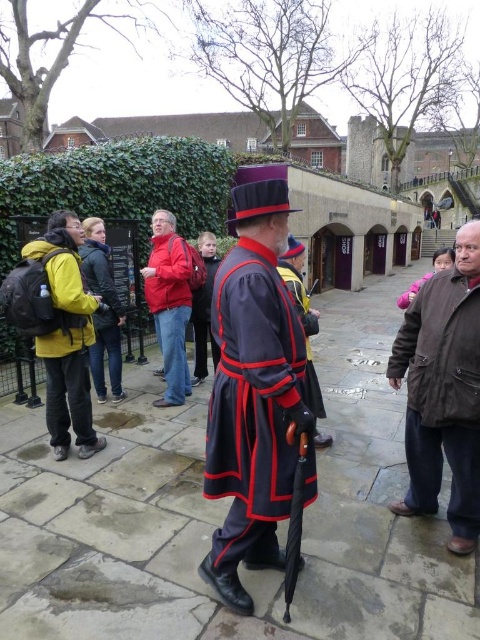
You are a photographer standing at the camera position. You want to take a photo focusing on the point at coordinates point (478, 262) and point (312, 394). Which point will appear larger in your photo?

Point (478, 262) is closer to the camera than point (312, 394), so it will appear larger in the photo.

You are a tourist visiting this historical site and want to take a photo of both the red fabric jacket at center and the matte black robe at center. Can you see both items clearly in the same frame without moving your camera position?

The matte black robe at center is behind the red fabric jacket at center, so the red fabric jacket at center may block part of the matte black robe at center in the photo. You might not be able to see both clearly in the same frame without moving your camera position.

You are a tourist standing at the center of the image and want to move towards the yellow matte jacket at left. Which direction should you move to reach it?

The yellow matte jacket at left is located at point (x=67, y=339), so you should move to the left to reach it.